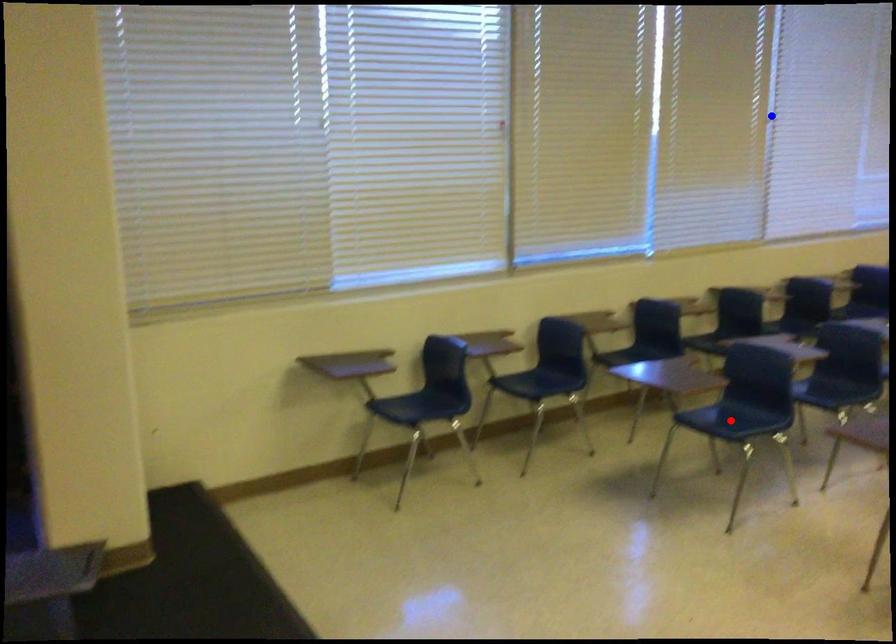
Question: Two points are marked on the image. Which point is closer to the camera?

Choices:
 (A) Blue point is closer.
 (B) Red point is closer.

Answer: (B)